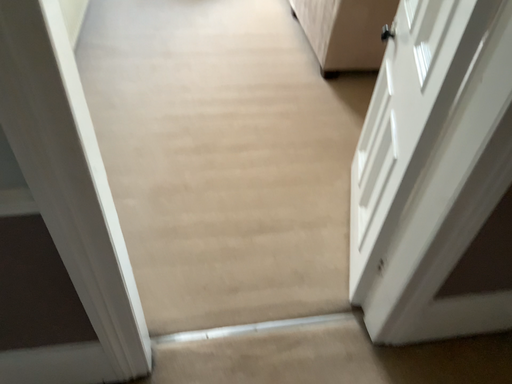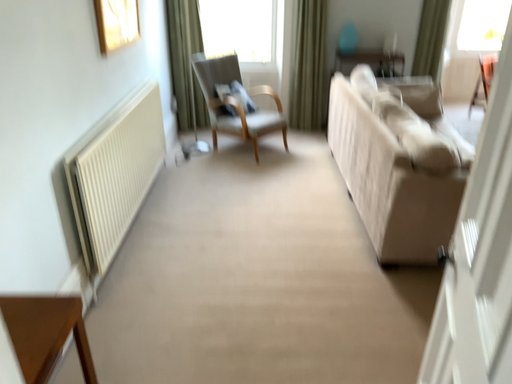
Question: How did the camera likely rotate when shooting the video?

Choices:
 (A) rotated downward
 (B) rotated upward

Answer: (B)